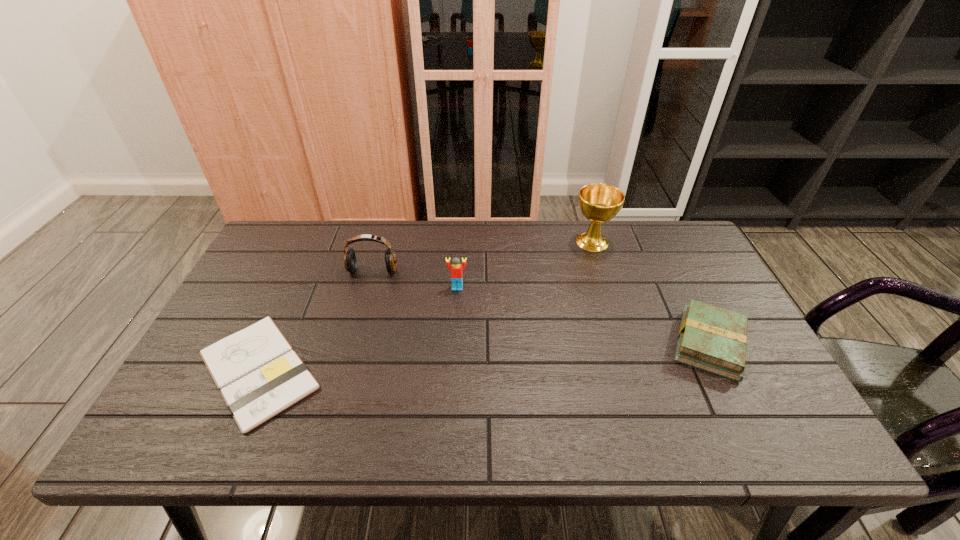
Where is `the farthest object`? This screenshot has height=540, width=960. the farthest object is located at coordinates (599, 203).

Find the location of a particular element. Image resolution: width=960 pixels, height=540 pixels. the fourth object from left to right is located at coordinates (599, 203).

Where is `headset`? The width and height of the screenshot is (960, 540). headset is located at coordinates (350, 262).

This screenshot has width=960, height=540. Identify the location of the fourth nearest object. (350, 262).

I want to click on the third tallest object, so click(456, 268).

Locate an element on the screen. This screenshot has height=540, width=960. the third object from left to right is located at coordinates (456, 268).

Find the location of `book`. book is located at coordinates (712, 339).

This screenshot has width=960, height=540. What are the coordinates of `the rightmost object` in the screenshot? It's located at (712, 339).

Where is `the shortest object`? Image resolution: width=960 pixels, height=540 pixels. the shortest object is located at coordinates (259, 375).

Identify the location of blank space located 0.170m on the right of the farthest object. (665, 241).